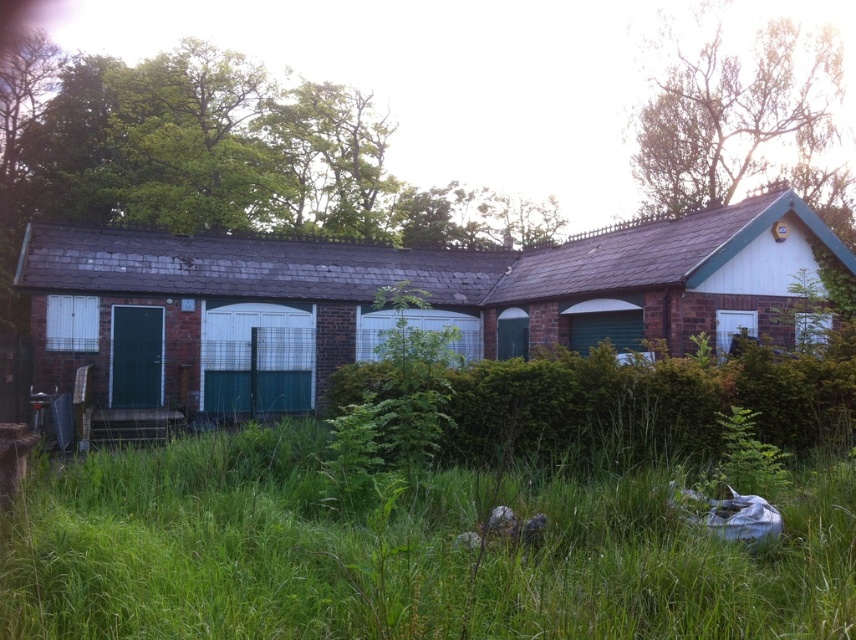
You are a landscape architect evaluating the property. You need to determine which area is smaller in size between the green grass at lower center and the brick wall garage at center. Which one is it?

The green grass at lower center occupies less space than the brick wall garage at center, so the green grass at lower center is the smaller area.

You are standing at the entrance of the rustic brick building and want to step onto the green grass at lower center. What are the coordinates where you should walk to?

The coordinates for the green grass at lower center are point [401,554].